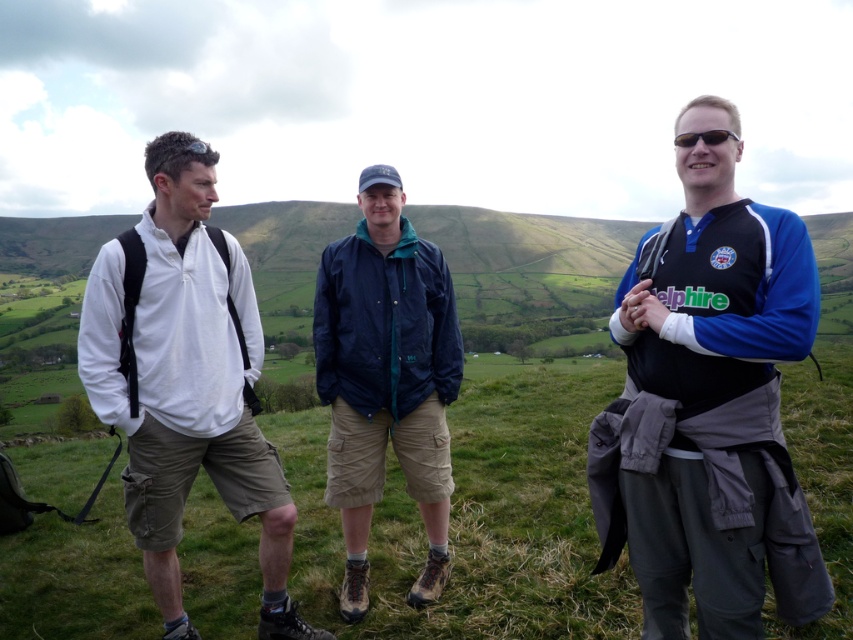
Is point (154, 141) positioned before point (428, 330)?

Yes, it is.

What do you see at coordinates (186, 381) in the screenshot? I see `white matte jacket at left` at bounding box center [186, 381].

What are the coordinates of `white matte jacket at left` in the screenshot? It's located at (186, 381).

The image size is (853, 640). Identify the location of white matte jacket at left. (186, 381).

Based on the photo, can you confirm if blue jersey at center is positioned to the left of black plastic sunglasses at right?

In fact, blue jersey at center is to the right of black plastic sunglasses at right.

Between blue jersey at center and black plastic sunglasses at right, which one appears on the right side from the viewer's perspective?

blue jersey at center is more to the right.

Locate an element on the screen. This screenshot has height=640, width=853. blue jersey at center is located at coordinates (711, 412).

This screenshot has height=640, width=853. I want to click on blue jersey at center, so click(x=711, y=412).

Which of these two, blue jersey at center or white matte jacket at left, stands taller?

white matte jacket at left is taller.

Can you confirm if blue jersey at center is thinner than white matte jacket at left?

Yes.

Who is more forward, (x=656, y=353) or (x=184, y=456)?

Point (x=656, y=353)

Locate an element on the screen. The height and width of the screenshot is (640, 853). blue jersey at center is located at coordinates (711, 412).